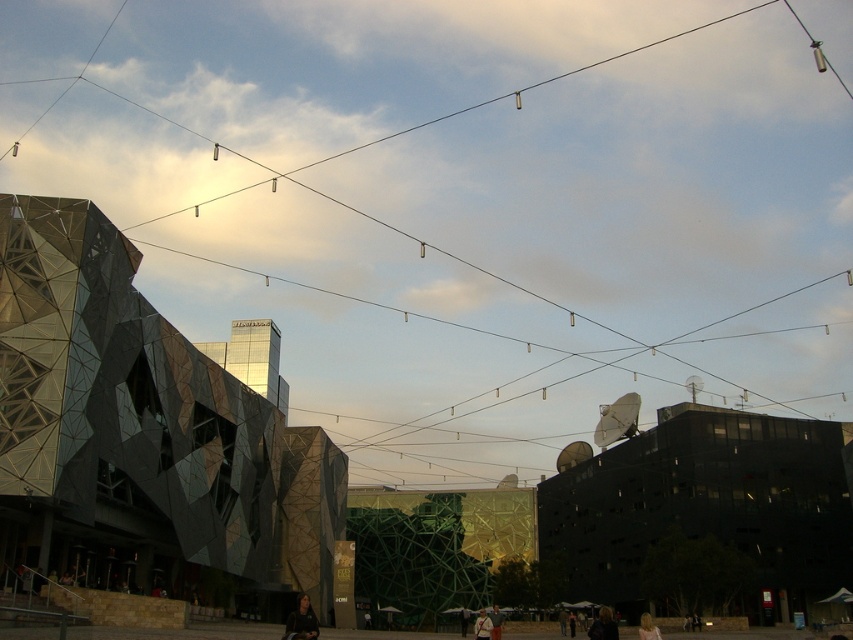
Based on the photo, you are a fashion designer observing the urban scene. You notice the dark brown leather jacket at lower right and the dark gray sweater at center. Which clothing item is shorter in length?

The dark brown leather jacket at lower right is shorter than the dark gray sweater at center.

You are a drone operator trying to navigate between buildings in the urban scene. You need to fly your drone to the dark glass building at center. According to the coordinates provided, what are the exact 2D coordinates you should aim for?

The exact 2D coordinates for the dark glass building at center are point [706,502].